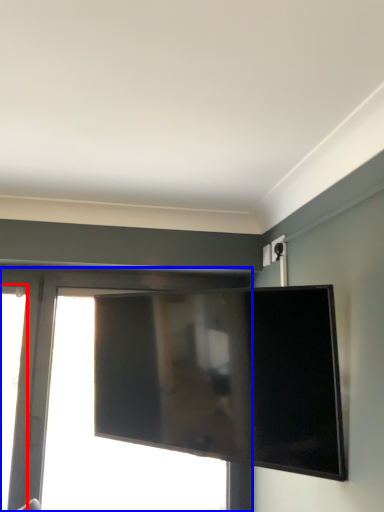
Question: Which object is closer to the camera taking this photo, window (highlighted by a red box) or window (highlighted by a blue box)?

Choices:
 (A) window
 (B) window

Answer: (A)